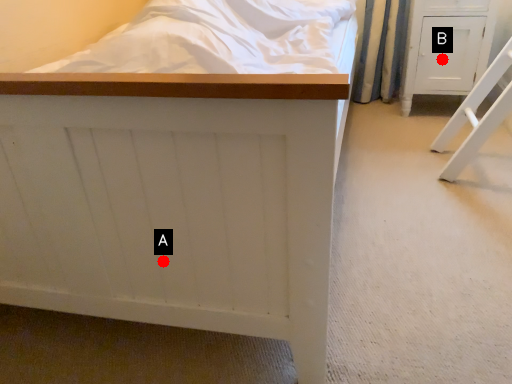
Question: Two points are circled on the image, labeled by A and B beside each circle. Which point is closer to the camera?

Choices:
 (A) A is closer
 (B) B is closer

Answer: (A)